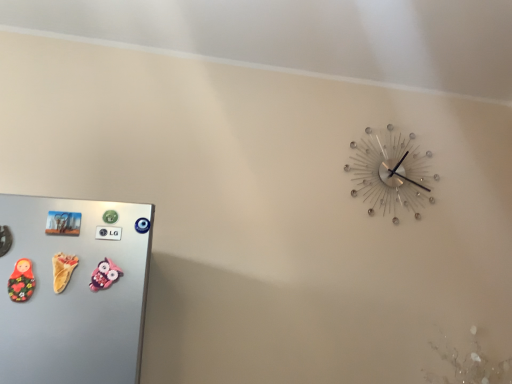
The image size is (512, 384). Find the location of `yellow rubber duck at left, which is the 2th toy in right-to-left order`. yellow rubber duck at left, which is the 2th toy in right-to-left order is located at coordinates (62, 270).

This screenshot has width=512, height=384. Describe the element at coordinates (21, 281) in the screenshot. I see `matte wooden doll at left, which ranks as the third toy in right-to-left order` at that location.

What do you see at coordinates (105, 275) in the screenshot? I see `pink fabric owl at lower left, the 1th toy in the right-to-left sequence` at bounding box center [105, 275].

What are the coordinates of `yellow rubber duck at left, marked as the second toy in a left-to-right arrangement` in the screenshot? It's located at (62, 270).

Is pink fabric owl at lower left, the 1th toy in the right-to-left sequence, surrounding metallic silver clock at upper right?

No, metallic silver clock at upper right is located outside of pink fabric owl at lower left, the 1th toy in the right-to-left sequence.

Consider the image. Is pink fabric owl at lower left, the 1th toy in the right-to-left sequence, next to metallic silver clock at upper right?

No, pink fabric owl at lower left, the 1th toy in the right-to-left sequence, is not next to metallic silver clock at upper right.

Does point (109, 274) appear closer or farther from the camera than point (392, 212)?

Point (109, 274) appears to be closer to the viewer than point (392, 212).

From the image's perspective, is pink fabric owl at lower left, which is the 3th toy in left-to-right order, under metallic silver clock at upper right?

Indeed, from the image's perspective, pink fabric owl at lower left, which is the 3th toy in left-to-right order, is shown beneath metallic silver clock at upper right.

Is metallic silver clock at upper right positioned before pink fabric owl at lower left, the 1th toy in the right-to-left sequence?

No, metallic silver clock at upper right is further to the viewer.

Who is shorter, metallic silver clock at upper right or pink fabric owl at lower left, the 1th toy in the right-to-left sequence?

pink fabric owl at lower left, the 1th toy in the right-to-left sequence, is shorter.

In the scene shown: From a real-world perspective, which object rests below the other?

pink fabric owl at lower left, the 1th toy in the right-to-left sequence, from a real-world perspective.

Is metallic silver clock at upper right oriented towards pink fabric owl at lower left, which is the 3th toy in left-to-right order?

No.

From the picture: Is metallic silver clock at upper right inside yellow rubber duck at left, marked as the second toy in a left-to-right arrangement?

Definitely not — metallic silver clock at upper right is not inside yellow rubber duck at left, marked as the second toy in a left-to-right arrangement.

From the image's perspective, is yellow rubber duck at left, which is the 2th toy in right-to-left order, beneath metallic silver clock at upper right?

Yes, from the image's perspective, yellow rubber duck at left, which is the 2th toy in right-to-left order, is below metallic silver clock at upper right.

Are yellow rubber duck at left, which is the 2th toy in right-to-left order, and metallic silver clock at upper right beside each other?

No, yellow rubber duck at left, which is the 2th toy in right-to-left order, is not beside metallic silver clock at upper right.

Is metallic silver clock at upper right not within yellow rubber duck at left, marked as the second toy in a left-to-right arrangement?

Yes.

From a real-world perspective, is metallic silver clock at upper right physically above yellow rubber duck at left, marked as the second toy in a left-to-right arrangement?

Correct, in the physical world, metallic silver clock at upper right is higher than yellow rubber duck at left, marked as the second toy in a left-to-right arrangement.

Is metallic silver clock at upper right turned away from yellow rubber duck at left, which is the 2th toy in right-to-left order?

No, metallic silver clock at upper right's orientation is not away from yellow rubber duck at left, which is the 2th toy in right-to-left order.

Which of these two, metallic silver clock at upper right or yellow rubber duck at left, which is the 2th toy in right-to-left order, is smaller?

Smaller between the two is yellow rubber duck at left, which is the 2th toy in right-to-left order.

Is yellow rubber duck at left, marked as the second toy in a left-to-right arrangement, not within pink fabric owl at lower left, which is the 3th toy in left-to-right order?

Absolutely, yellow rubber duck at left, marked as the second toy in a left-to-right arrangement, is external to pink fabric owl at lower left, which is the 3th toy in left-to-right order.

In the scene shown: Between yellow rubber duck at left, which is the 2th toy in right-to-left order, and pink fabric owl at lower left, the 1th toy in the right-to-left sequence, which one appears on the right side from the viewer's perspective?

pink fabric owl at lower left, the 1th toy in the right-to-left sequence, is more to the right.

Between yellow rubber duck at left, which is the 2th toy in right-to-left order, and pink fabric owl at lower left, which is the 3th toy in left-to-right order, which one has smaller width?

Thinner between the two is pink fabric owl at lower left, which is the 3th toy in left-to-right order.

Based on the photo, is matte wooden doll at left, which ranks as the third toy in right-to-left order, taller or shorter than yellow rubber duck at left, marked as the second toy in a left-to-right arrangement?

Clearly, matte wooden doll at left, which ranks as the third toy in right-to-left order, is taller compared to yellow rubber duck at left, marked as the second toy in a left-to-right arrangement.

Is matte wooden doll at left, which is counted as the first toy, starting from the left, to the left of yellow rubber duck at left, marked as the second toy in a left-to-right arrangement, from the viewer's perspective?

Yes, matte wooden doll at left, which is counted as the first toy, starting from the left, is to the left of yellow rubber duck at left, marked as the second toy in a left-to-right arrangement.

Is matte wooden doll at left, which ranks as the third toy in right-to-left order, next to yellow rubber duck at left, which is the 2th toy in right-to-left order?

Yes, matte wooden doll at left, which ranks as the third toy in right-to-left order, is right next to yellow rubber duck at left, which is the 2th toy in right-to-left order, and making contact.

From the image's perspective, count 2nd toys upward from the matte wooden doll at left, which is counted as the first toy, starting from the left, and point to it. Please provide its 2D coordinates.

[(62, 270)]

From a real-world perspective, between pink fabric owl at lower left, the 1th toy in the right-to-left sequence, and yellow rubber duck at left, which is the 2th toy in right-to-left order, who is vertically lower?

In real-world perspective, pink fabric owl at lower left, the 1th toy in the right-to-left sequence, is lower.

Which object is closer to the camera, pink fabric owl at lower left, which is the 3th toy in left-to-right order, or yellow rubber duck at left, marked as the second toy in a left-to-right arrangement?

yellow rubber duck at left, marked as the second toy in a left-to-right arrangement.

Considering the points (115, 271) and (53, 281), which point is in front, point (115, 271) or point (53, 281)?

Point (53, 281)

Is pink fabric owl at lower left, the 1th toy in the right-to-left sequence, far away from yellow rubber duck at left, marked as the second toy in a left-to-right arrangement?

pink fabric owl at lower left, the 1th toy in the right-to-left sequence, is actually quite close to yellow rubber duck at left, marked as the second toy in a left-to-right arrangement.

At what (x,y) coordinates should I click in order to perform the action: click on wall clock above the pink fabric owl at lower left, the 1th toy in the right-to-left sequence (from a real-world perspective). Please return your answer as a coordinate pair (x, y). The width and height of the screenshot is (512, 384). Looking at the image, I should click on (389, 173).

The image size is (512, 384). In the image, there is a pink fabric owl at lower left, which is the 3th toy in left-to-right order. Find the location of `wall clock above it (from the image's perspective)`. wall clock above it (from the image's perspective) is located at coordinates (389, 173).

From the image, which object appears to be nearer to matte wooden doll at left, which ranks as the third toy in right-to-left order, metallic silver clock at upper right or yellow rubber duck at left, marked as the second toy in a left-to-right arrangement?

Among the two, yellow rubber duck at left, marked as the second toy in a left-to-right arrangement, is located nearer to matte wooden doll at left, which ranks as the third toy in right-to-left order.

Which object lies further to the anchor point matte wooden doll at left, which is counted as the first toy, starting from the left, yellow rubber duck at left, marked as the second toy in a left-to-right arrangement, or metallic silver clock at upper right?

metallic silver clock at upper right.

When comparing their distances from metallic silver clock at upper right, does yellow rubber duck at left, which is the 2th toy in right-to-left order, or pink fabric owl at lower left, the 1th toy in the right-to-left sequence, seem further?

yellow rubber duck at left, which is the 2th toy in right-to-left order.

Which object lies further to the anchor point yellow rubber duck at left, which is the 2th toy in right-to-left order, matte wooden doll at left, which ranks as the third toy in right-to-left order, or pink fabric owl at lower left, which is the 3th toy in left-to-right order?

pink fabric owl at lower left, which is the 3th toy in left-to-right order, lies further to yellow rubber duck at left, which is the 2th toy in right-to-left order, than the other object.

Estimate the real-world distances between objects in this image. Which object is further from pink fabric owl at lower left, the 1th toy in the right-to-left sequence, yellow rubber duck at left, marked as the second toy in a left-to-right arrangement, or metallic silver clock at upper right?

metallic silver clock at upper right is positioned further to the anchor pink fabric owl at lower left, the 1th toy in the right-to-left sequence.

From the image, which object appears to be nearer to metallic silver clock at upper right, pink fabric owl at lower left, the 1th toy in the right-to-left sequence, or matte wooden doll at left, which ranks as the third toy in right-to-left order?

Based on the image, pink fabric owl at lower left, the 1th toy in the right-to-left sequence, appears to be nearer to metallic silver clock at upper right.

Based on their spatial positions, is pink fabric owl at lower left, which is the 3th toy in left-to-right order, or metallic silver clock at upper right closer to yellow rubber duck at left, which is the 2th toy in right-to-left order?

pink fabric owl at lower left, which is the 3th toy in left-to-right order, lies closer to yellow rubber duck at left, which is the 2th toy in right-to-left order, than the other object.

Considering their positions, is metallic silver clock at upper right positioned closer to pink fabric owl at lower left, which is the 3th toy in left-to-right order, than matte wooden doll at left, which ranks as the third toy in right-to-left order?

matte wooden doll at left, which ranks as the third toy in right-to-left order.

This screenshot has width=512, height=384. I want to click on toy between yellow rubber duck at left, which is the 2th toy in right-to-left order, and metallic silver clock at upper right, so click(105, 275).

Locate an element on the screen. toy situated between matte wooden doll at left, which ranks as the third toy in right-to-left order, and pink fabric owl at lower left, the 1th toy in the right-to-left sequence, from left to right is located at coordinates (62, 270).